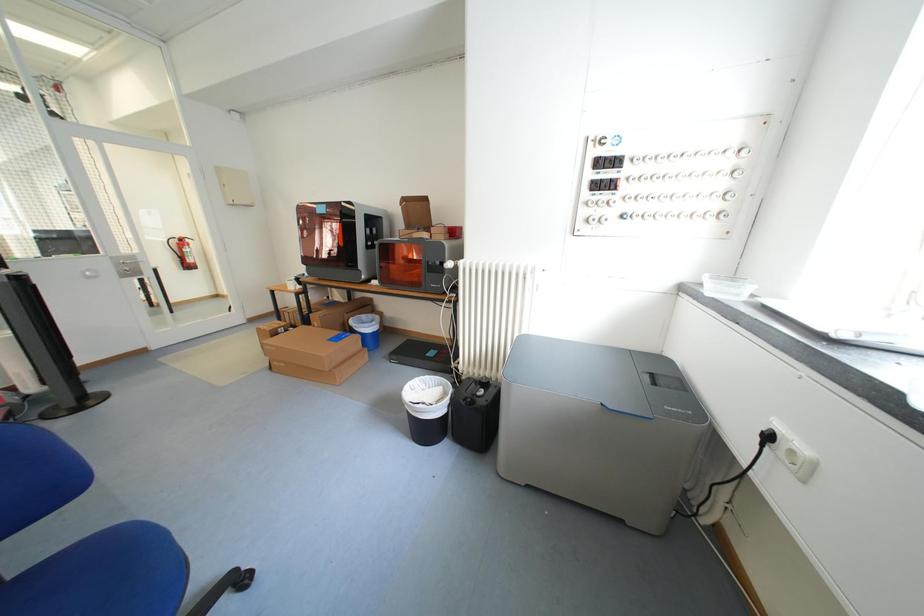
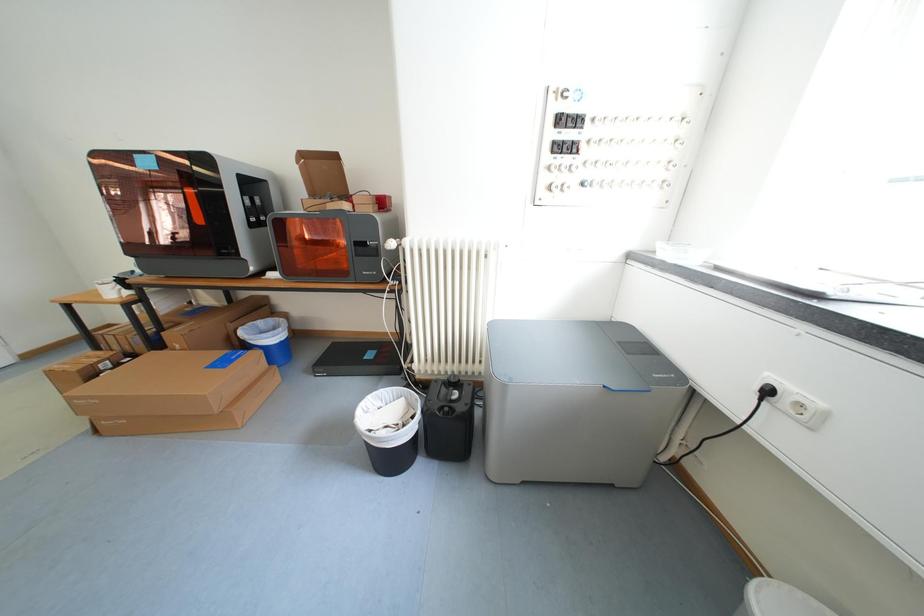
Which direction would the cameraman need to move to produce the second image?

The movement direction of the cameraman is left, forward.